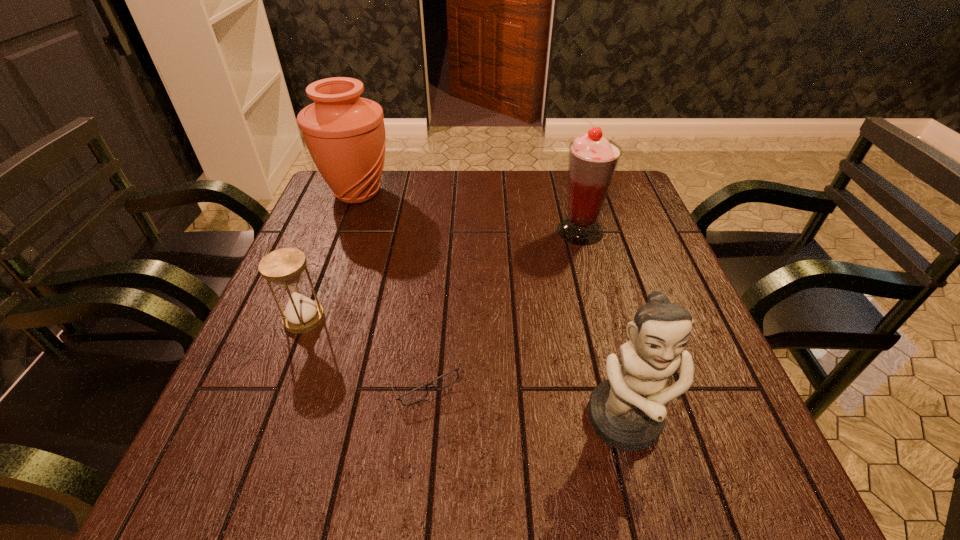
Identify the location of vacant space situated 0.070m with the lenses facing outward on the third object from right to left. (417, 446).

I want to click on object at the far edge, so click(x=345, y=134).

Find the location of `object present at the near edge`. object present at the near edge is located at coordinates (627, 412).

Identify the location of vase located at the left edge. (345, 134).

This screenshot has height=540, width=960. What are the coordinates of `hourglass that is at the left edge` in the screenshot? It's located at (284, 267).

The image size is (960, 540). I want to click on smoothie that is at the right edge, so click(593, 160).

Image resolution: width=960 pixels, height=540 pixels. I want to click on figurine at the right edge, so click(627, 412).

This screenshot has width=960, height=540. What are the coordinates of `object at the far left corner` in the screenshot? It's located at (345, 134).

Where is `object that is positioned at the near right corner`? Image resolution: width=960 pixels, height=540 pixels. object that is positioned at the near right corner is located at coordinates (627, 412).

At what (x,y) coordinates should I click in order to perform the action: click on vacant space at the far edge of the desktop. Please return your answer as a coordinate pair (x, y). This screenshot has height=540, width=960. Looking at the image, I should click on (468, 210).